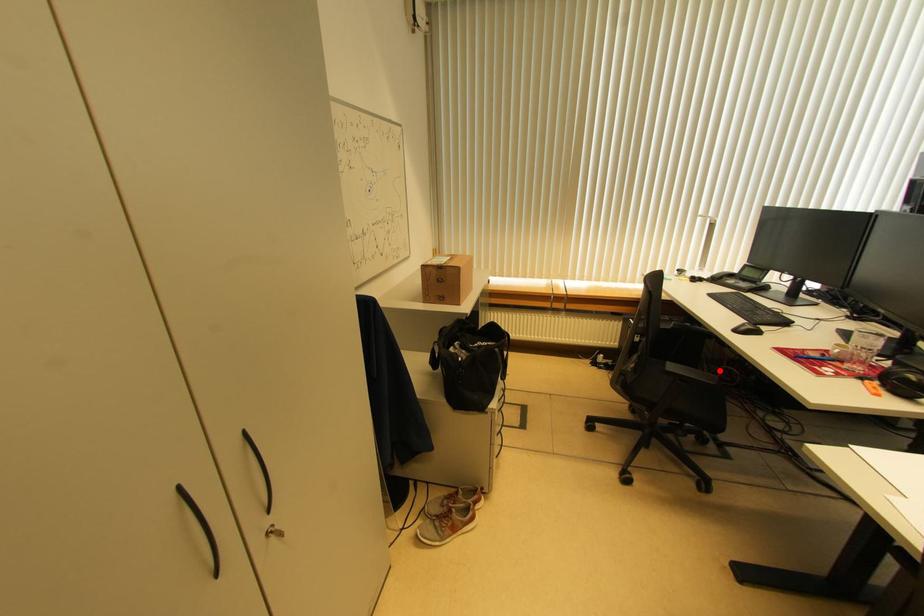
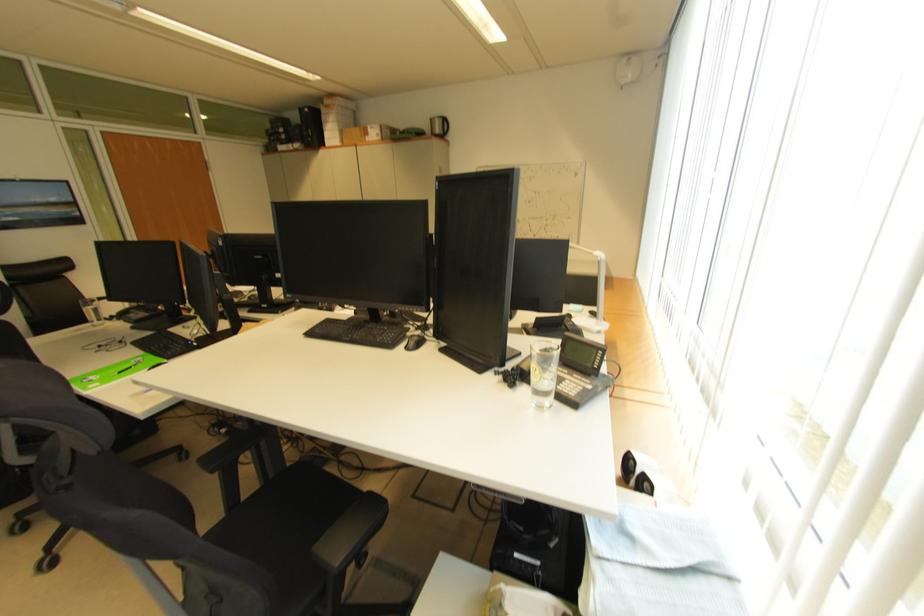
Question: I am providing you with two images of the same scene from different viewpoints. A red point is marked on the first image. At the location where the point appears in image 1, is it still visible in image 2?

Choices:
 (A) Yes
 (B) No

Answer: (B)